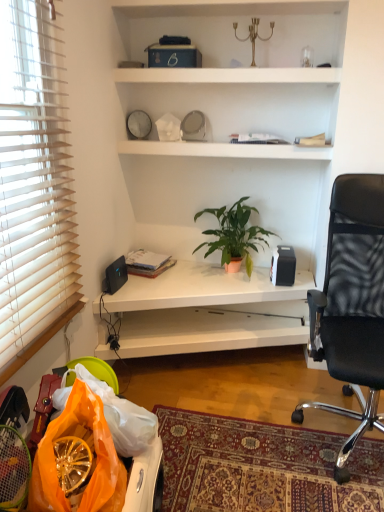
Question: Is black matte speaker at upper right, which ranks as the second loudspeaker in left-to-right order, to the left of black mesh office chair at right from the viewer's perspective?

Choices:
 (A) yes
 (B) no

Answer: (A)

Question: Is the position of black matte speaker at upper right, acting as the first loudspeaker starting from the right, more distant than that of black mesh office chair at right?

Choices:
 (A) no
 (B) yes

Answer: (B)

Question: Does black matte speaker at upper right, acting as the first loudspeaker starting from the right, have a smaller size compared to black mesh office chair at right?

Choices:
 (A) yes
 (B) no

Answer: (A)

Question: From a real-world perspective, is black matte speaker at upper right, which ranks as the second loudspeaker in left-to-right order, on top of black mesh office chair at right?

Choices:
 (A) yes
 (B) no

Answer: (B)

Question: Is black mesh office chair at right inside black matte speaker at upper right, which ranks as the second loudspeaker in left-to-right order?

Choices:
 (A) yes
 (B) no

Answer: (B)

Question: Considering the relative sizes of black matte speaker at upper right, acting as the first loudspeaker starting from the right, and black mesh office chair at right in the image provided, is black matte speaker at upper right, acting as the first loudspeaker starting from the right, shorter than black mesh office chair at right?

Choices:
 (A) no
 (B) yes

Answer: (B)

Question: Is matte black book at left located outside black matte speaker at upper right, acting as the first loudspeaker starting from the right?

Choices:
 (A) yes
 (B) no

Answer: (A)

Question: From a real-world perspective, is matte black book at left positioned over black matte speaker at upper right, which ranks as the second loudspeaker in left-to-right order, based on gravity?

Choices:
 (A) no
 (B) yes

Answer: (A)

Question: Considering the relative positions of matte black book at left and black matte speaker at upper right, acting as the first loudspeaker starting from the right, in the image provided, is matte black book at left to the left of black matte speaker at upper right, acting as the first loudspeaker starting from the right, from the viewer's perspective?

Choices:
 (A) no
 (B) yes

Answer: (B)

Question: From the image's perspective, is matte black book at left on top of black matte speaker at upper right, acting as the first loudspeaker starting from the right?

Choices:
 (A) yes
 (B) no

Answer: (B)

Question: From the image's perspective, is matte black book at left located beneath black matte speaker at upper right, acting as the first loudspeaker starting from the right?

Choices:
 (A) yes
 (B) no

Answer: (A)

Question: Considering the relative positions of matte black book at left and black matte speaker at upper right, acting as the first loudspeaker starting from the right, in the image provided, is matte black book at left to the right of black matte speaker at upper right, acting as the first loudspeaker starting from the right, from the viewer's perspective?

Choices:
 (A) no
 (B) yes

Answer: (A)

Question: Considering the relative sizes of green matte plant at center and black plastic speaker at lower left, which is the second loudspeaker from right to left, in the image provided, is green matte plant at center thinner than black plastic speaker at lower left, which is the second loudspeaker from right to left,?

Choices:
 (A) yes
 (B) no

Answer: (B)